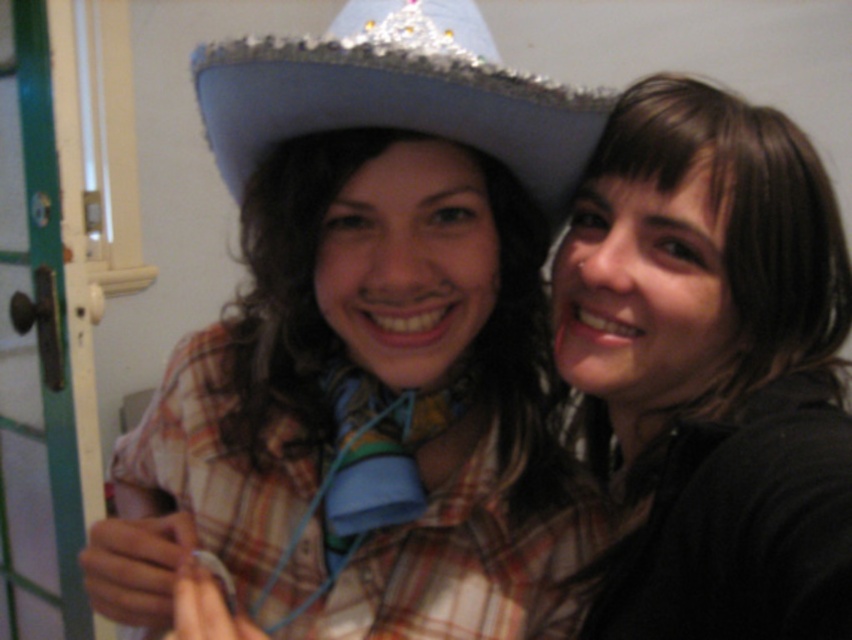
You are a photographer trying to capture a clear photo of both the brown matte hair at upper right and the shiny silver sombrero at upper center. Based on their heights, which one should you focus on first to ensure both are in frame?

The brown matte hair at upper right is much taller than the shiny silver sombrero at upper center, so you should focus on the brown matte hair at upper right first to ensure both are in frame.

You are taking a photo of two people standing in front of you. You notice two specific points on their outfits. One is at coordinate point (227, 497) and the other at point (309, 51). Which point will appear closer to the camera in the photo?

Point (227, 497) is further to the camera than point (309, 51), so the point at (227, 497) will appear closer to the camera in the photo.

In the scene shown: You are a photographer trying to capture a clear shot of both the brown matte hair at upper right and the shiny silver sombrero at upper center. Based on their positions, which object is positioned lower in the frame?

The brown matte hair at upper right is located below the shiny silver sombrero at upper center, so it is positioned lower in the frame.